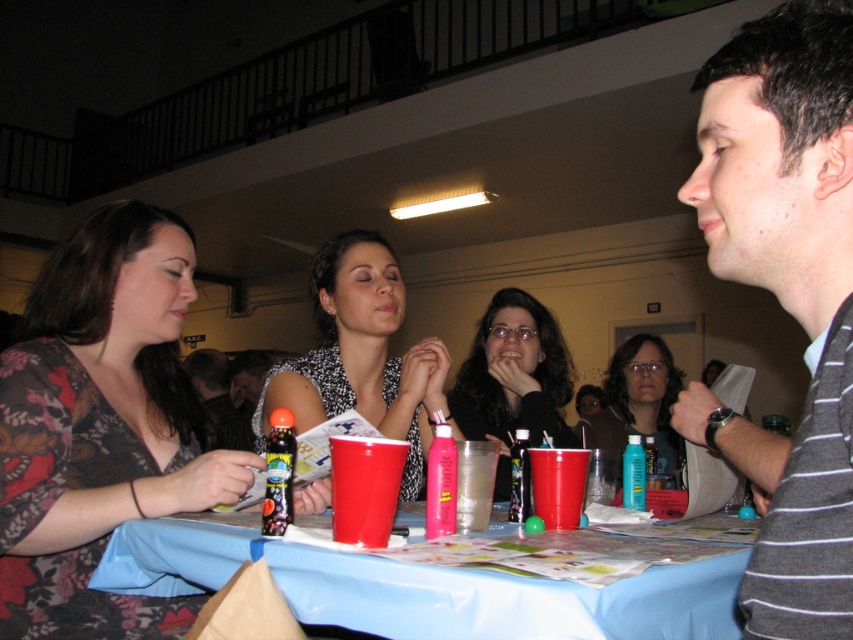
Does blue plastic table at center have a larger size compared to pink plastic cup at table center?

Yes, blue plastic table at center is bigger than pink plastic cup at table center.

Does point (479, 573) come in front of point (440, 534)?

That is True.

This screenshot has height=640, width=853. I want to click on blue plastic table at center, so click(x=422, y=588).

Based on the photo, how far apart are matte black jacket at center and matte plastic cup at table center?

matte black jacket at center and matte plastic cup at table center are 87.59 centimeters apart.

Looking at this image, can you confirm if matte black jacket at center is positioned to the left of matte plastic cup at table center?

Incorrect, matte black jacket at center is not on the left side of matte plastic cup at table center.

Between point (561, 362) and point (347, 467), which one is positioned in front?

Point (347, 467) is in front.

Identify the location of matte black jacket at center. (514, 374).

Describe the element at coordinates (785, 294) in the screenshot. I see `gray striped shirt at right` at that location.

Does gray striped shirt at right appear on the right side of matte plastic cup at table center?

Correct, you'll find gray striped shirt at right to the right of matte plastic cup at table center.

Between point (764, 608) and point (352, 522), which one is positioned in front?

Point (764, 608) is in front.

This screenshot has height=640, width=853. What are the coordinates of `gray striped shirt at right` in the screenshot? It's located at (785, 294).